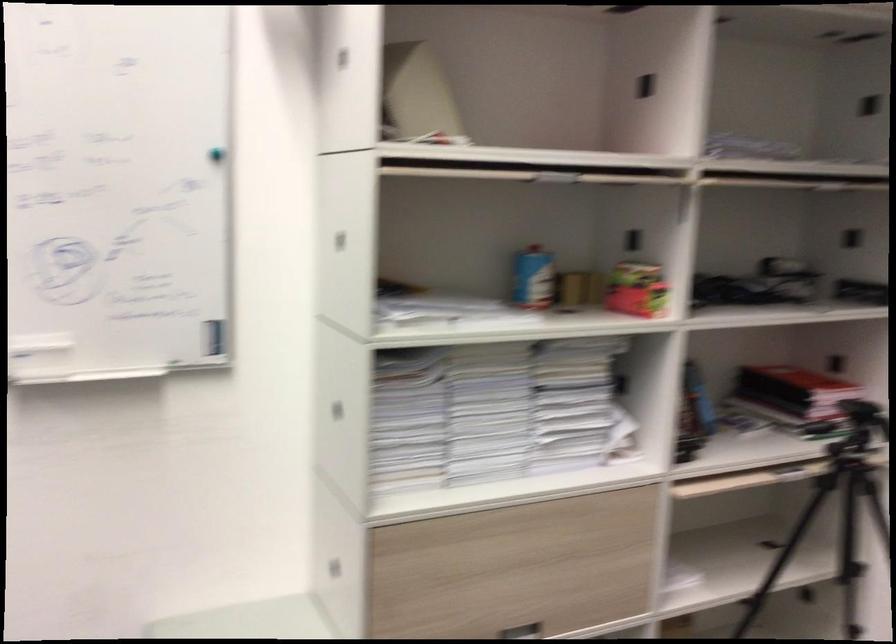
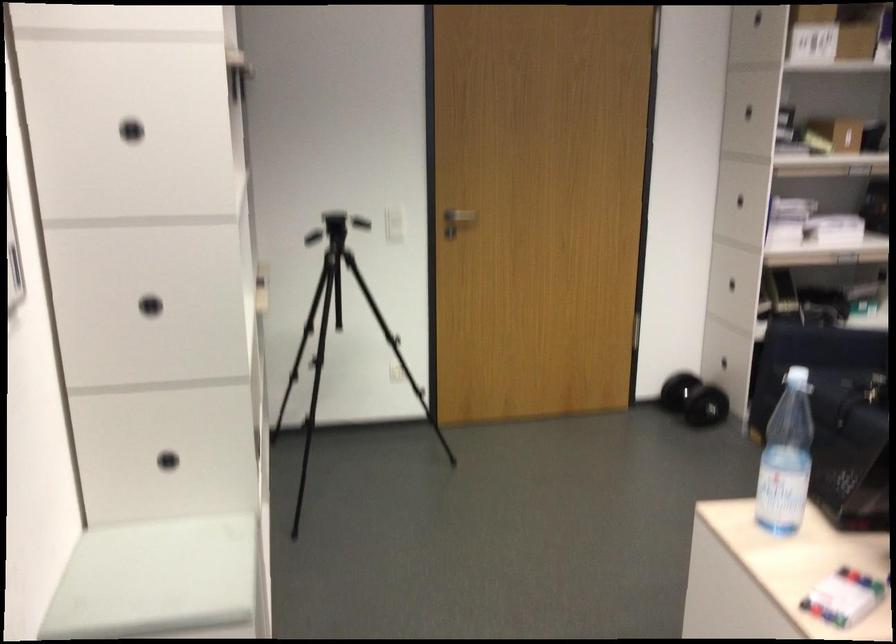
Question: I am providing you with two images of the same scene from different viewpoints. Please identify which objects are invisible in image2.

Choices:
 (A) pink patterned box
 (B) blind pull tab
 (C) black cabinet handle
 (D) bench sitting surface

Answer: (A)